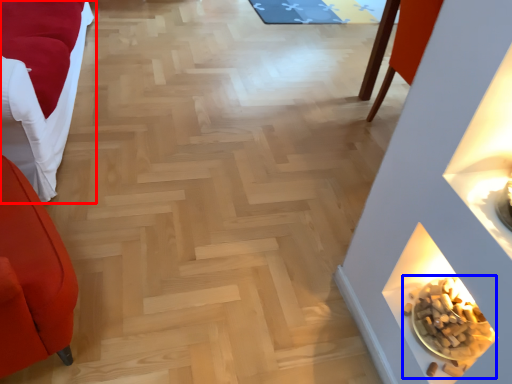
Question: Which point is further to the camera, furniture (highlighted by a red box) or food (highlighted by a blue box)?

Choices:
 (A) furniture
 (B) food

Answer: (B)